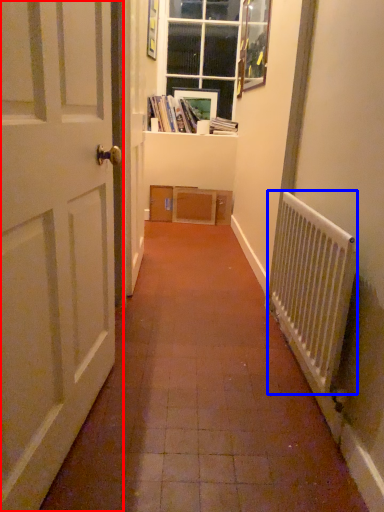
Question: Which object is closer to the camera taking this photo, door (highlighted by a red box) or radiator (highlighted by a blue box)?

Choices:
 (A) door
 (B) radiator

Answer: (A)